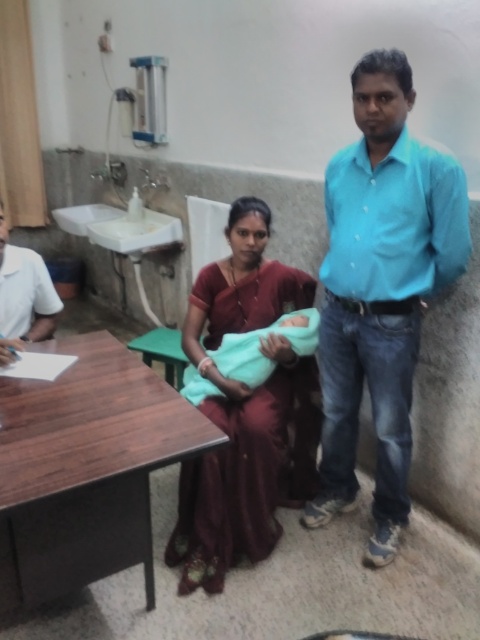
You are organizing a fashion show and need to determine the display order for two garments based on their widths. The garments are the maroon silk saree at center and the white smooth shirt at left. Which garment should be placed first if you want to arrange them from widest to narrowest?

The maroon silk saree at center should be placed first since it might be wider than the white smooth shirt at left according to the description.

What is located at the point with coordinates (245, 412)?

The point with coordinates (245, 412) is on the maroon silk saree at center.